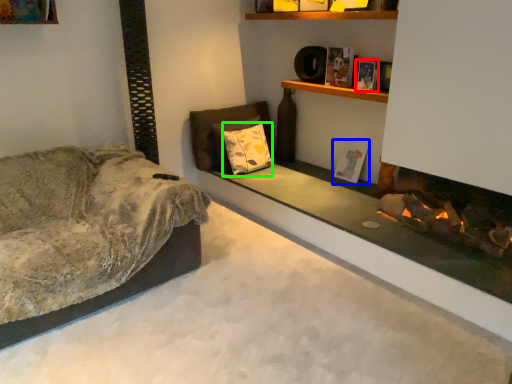
Question: Which object is positioned closest to book (highlighted by a red box)? Select from book (highlighted by a blue box) and pillow (highlighted by a green box).

Choices:
 (A) book
 (B) pillow

Answer: (A)